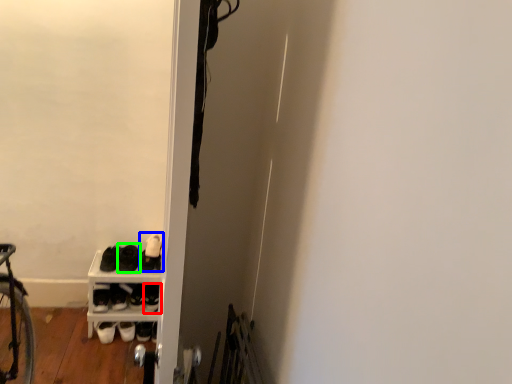
Question: Estimate the real-world distances between objects in this image. Which object is closer to footwear (highlighted by a red box), footwear (highlighted by a blue box) or footwear (highlighted by a green box)?

Choices:
 (A) footwear
 (B) footwear

Answer: (B)